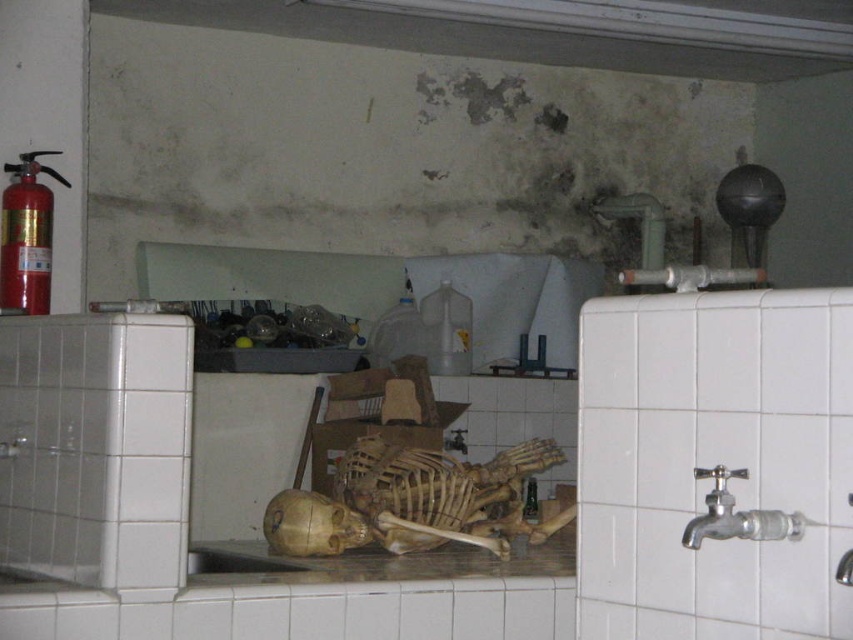
Is point (416, 456) in front of point (682, 532)?

No, it is not.

Which is behind, point (386, 524) or point (688, 525)?

The point (386, 524) is more distant.

Find the location of a particular element. brown wooden skeleton at center is located at coordinates (413, 500).

Consider the image. Does brown wooden skeleton at center have a smaller size compared to wooden skeleton at center?

Yes.

Does brown wooden skeleton at center lie behind wooden skeleton at center?

Yes, brown wooden skeleton at center is behind wooden skeleton at center.

Where is `brown wooden skeleton at center`? brown wooden skeleton at center is located at coordinates (413, 500).

Locate an element on the screen. The height and width of the screenshot is (640, 853). brown wooden skeleton at center is located at coordinates (413, 500).

How far apart are wooden skeleton at center and silver metallic faucet at right?

A distance of 38.78 inches exists between wooden skeleton at center and silver metallic faucet at right.

In the scene shown: Does wooden skeleton at center have a lesser height compared to silver metallic faucet at right?

No.

Does point (370, 548) lie behind point (683, 538)?

Yes.

Where is `wooden skeleton at center`? The width and height of the screenshot is (853, 640). wooden skeleton at center is located at coordinates (390, 561).